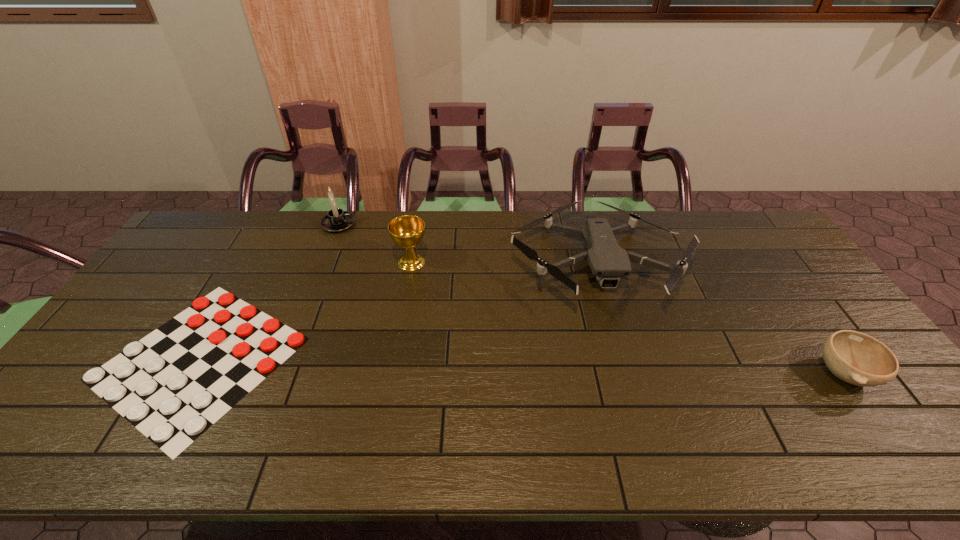
Identify the location of blank space that satisfies the following two spatial constraints: 1. with a handle on the side of the candle holder; 2. on the left side of the rightmost object. This screenshot has width=960, height=540. (280, 373).